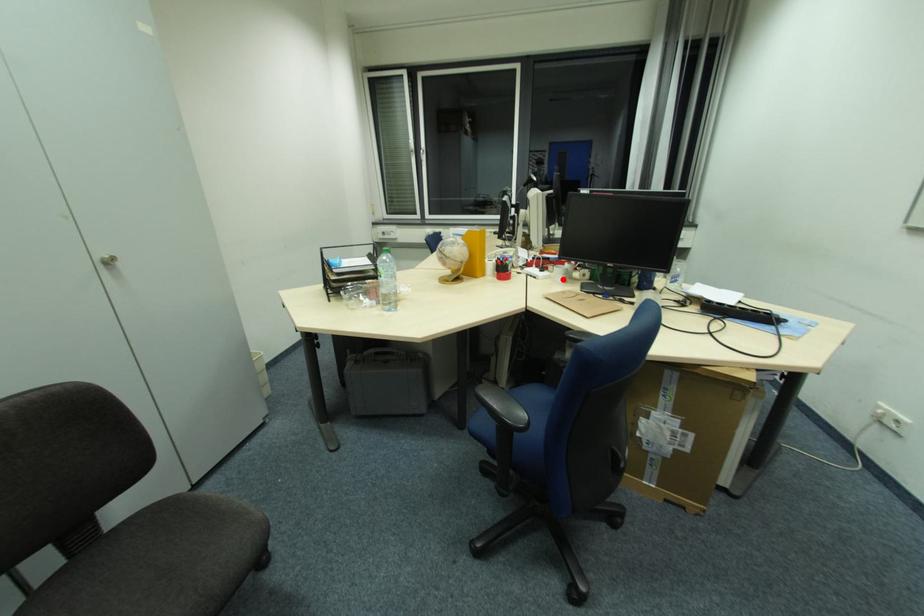
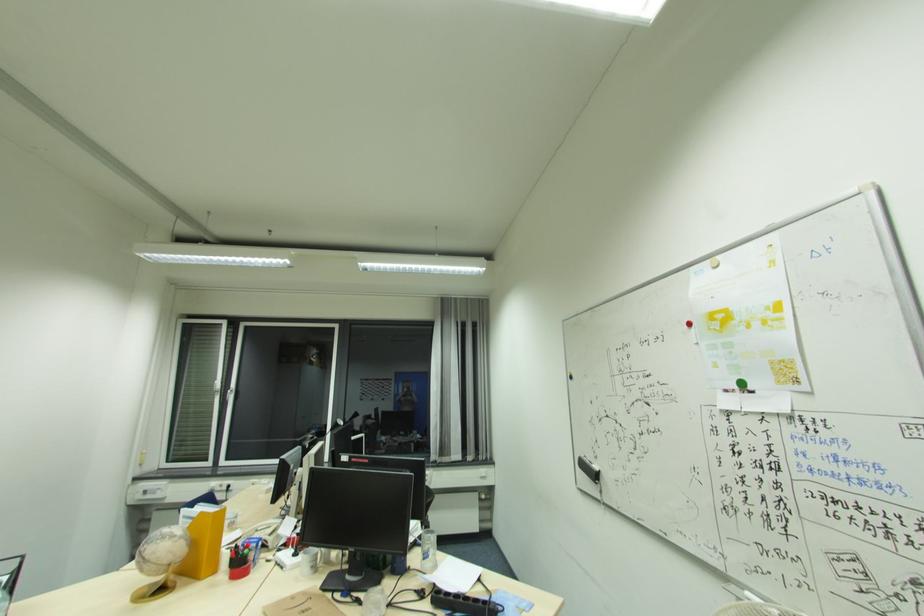
Locate, in the second image, the point that corresponds to the highlighted location in the first image.

(310, 570)